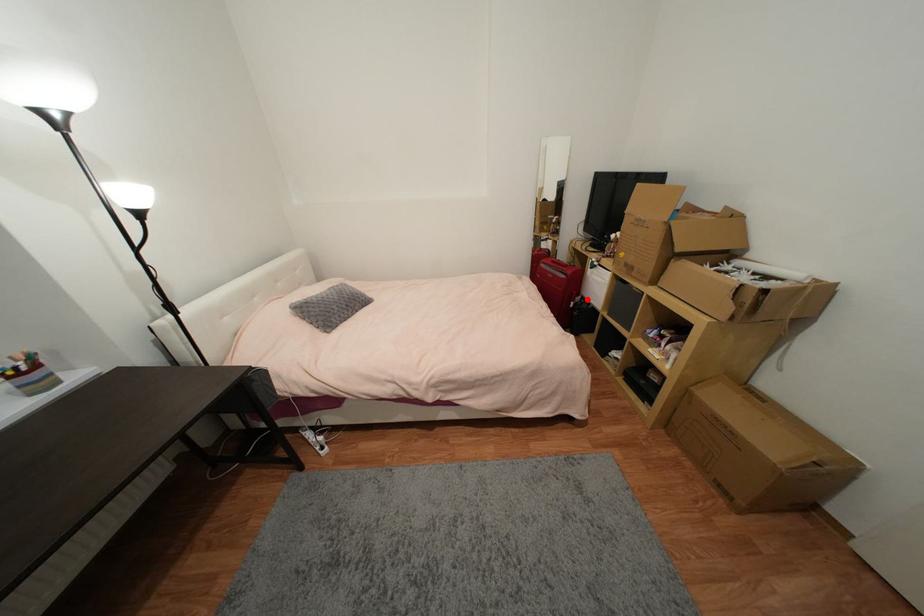
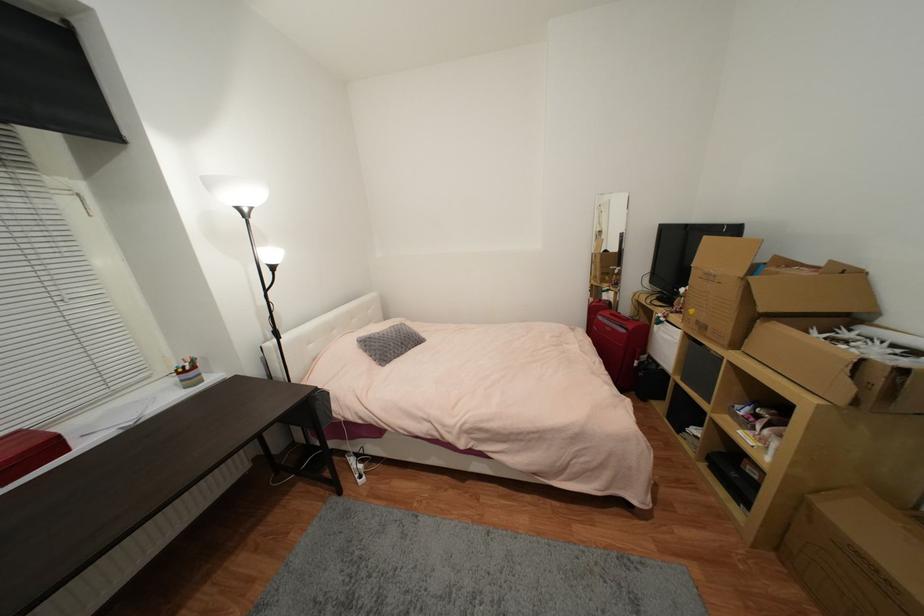
In the second image, find the point that corresponds to the highlighted location in the first image.

(653, 359)